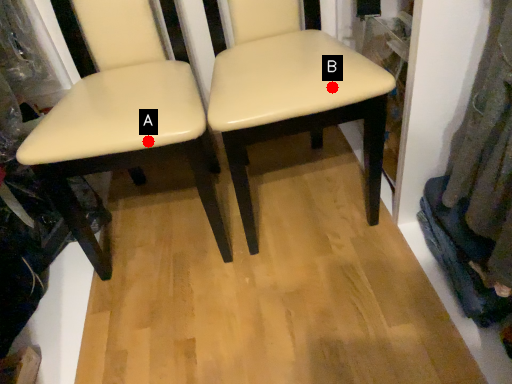
Question: Two points are circled on the image, labeled by A and B beside each circle. Which point appears farthest from the camera in this image?

Choices:
 (A) A is further
 (B) B is further

Answer: (B)